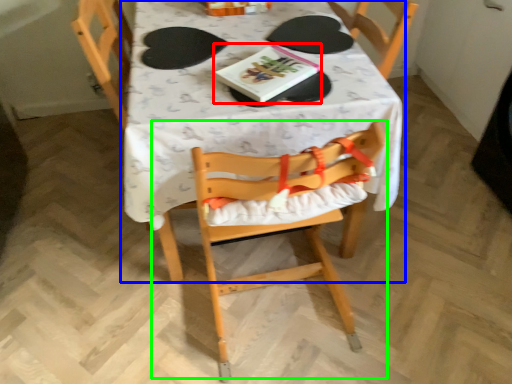
Question: Estimate the real-world distances between objects in this image. Which object is closer to book (highlighted by a red box), table (highlighted by a blue box) or chair (highlighted by a green box)?

Choices:
 (A) table
 (B) chair

Answer: (A)